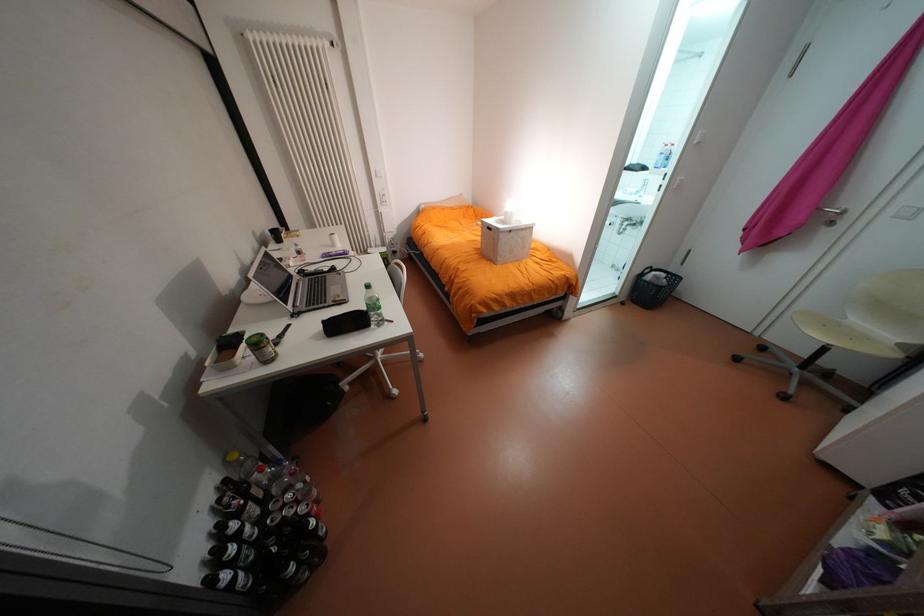
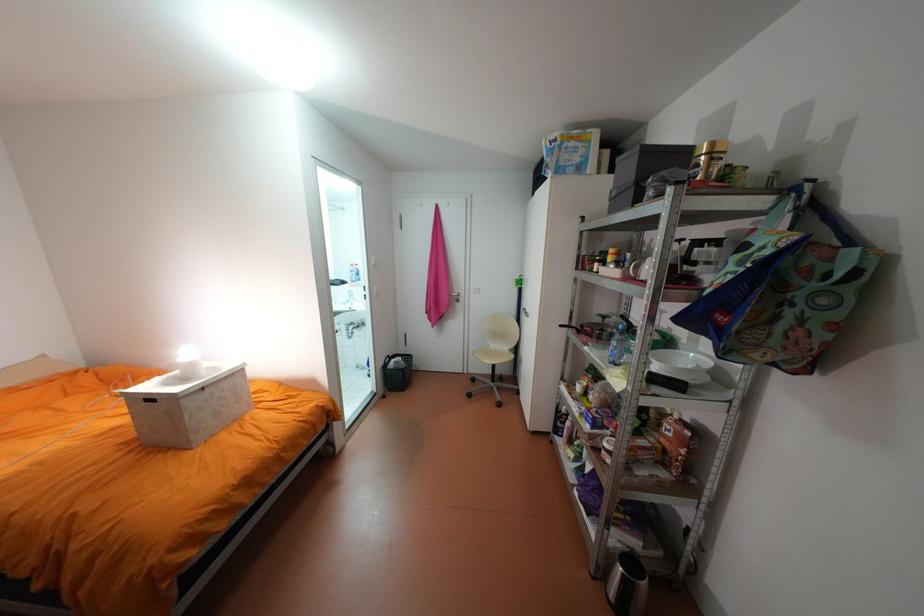
Find the pixel in the second image that matches (663,273) in the first image.

(402, 360)